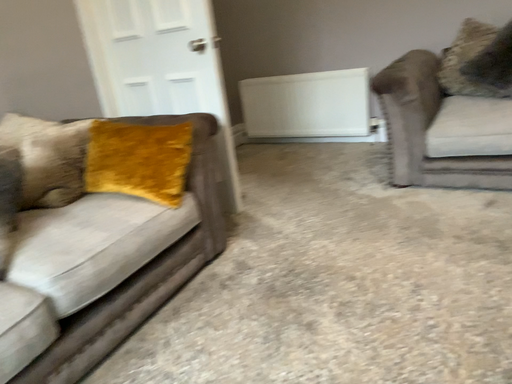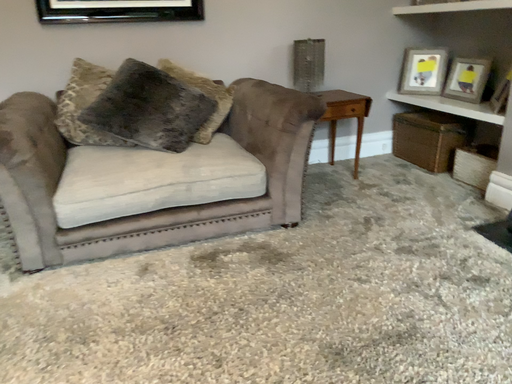
Question: How did the camera likely rotate when shooting the video?

Choices:
 (A) rotated right
 (B) rotated left

Answer: (A)